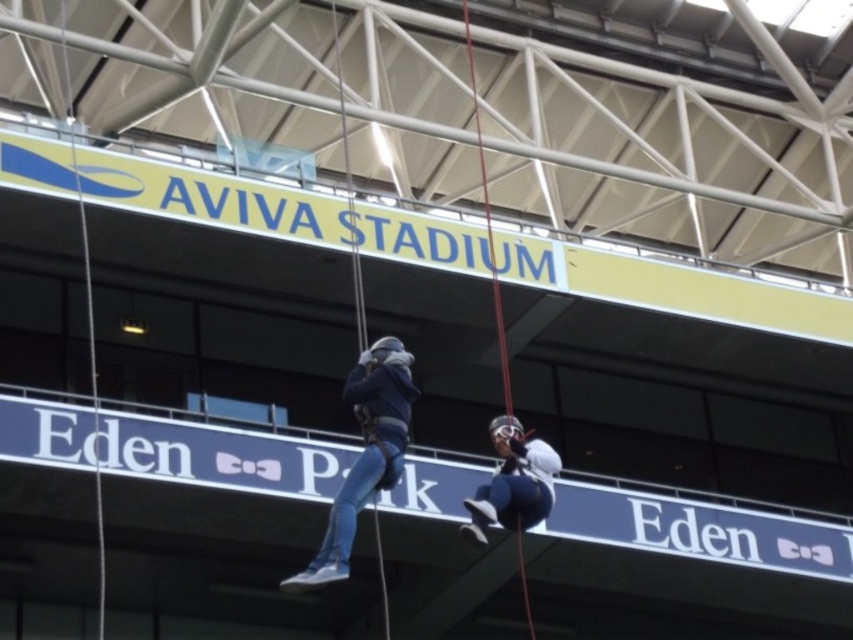
Question: Which of the following is the farthest from the observer?

Choices:
 (A) (409, 417)
 (B) (511, 528)

Answer: (B)

Question: Can you confirm if blue denim jeans at center is thinner than white matte helmet at center?

Choices:
 (A) yes
 (B) no

Answer: (B)

Question: Among these points, which one is nearest to the camera?

Choices:
 (A) (468, 502)
 (B) (393, 435)

Answer: (B)

Question: From the image, what is the correct spatial relationship of blue denim jeans at center in relation to white matte helmet at center?

Choices:
 (A) right
 (B) left

Answer: (B)

Question: Is blue denim jeans at center positioned at the back of white matte helmet at center?

Choices:
 (A) no
 (B) yes

Answer: (A)

Question: Which point appears farthest from the camera in this image?

Choices:
 (A) (505, 436)
 (B) (351, 490)

Answer: (A)